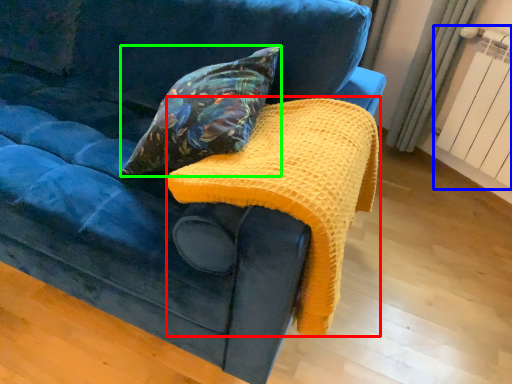
Question: Considering the real-world distances, which object is closest to blanket (highlighted by a red box)? radiator (highlighted by a blue box) or pillow (highlighted by a green box).

Choices:
 (A) radiator
 (B) pillow

Answer: (B)